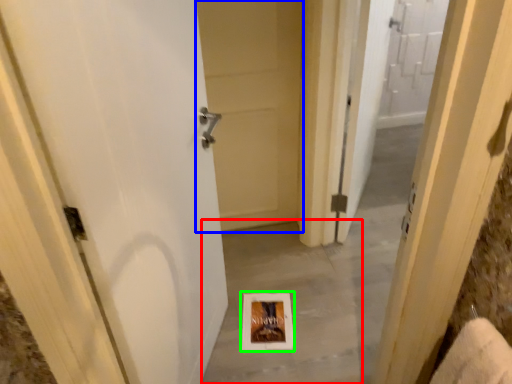
Question: Which is nearer to the concrete (highlighted by a red box)? door (highlighted by a blue box) or picture frame (highlighted by a green box).

Choices:
 (A) door
 (B) picture frame

Answer: (B)